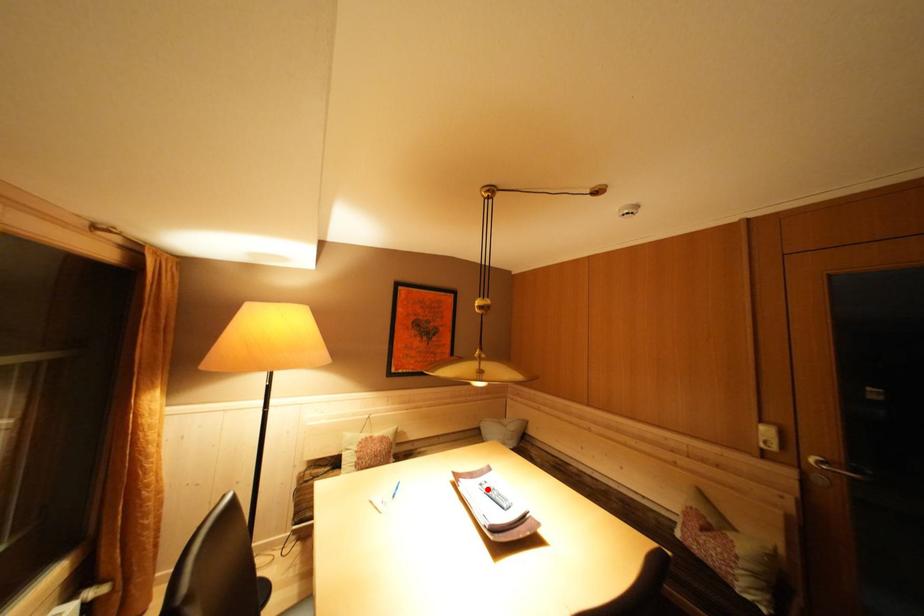
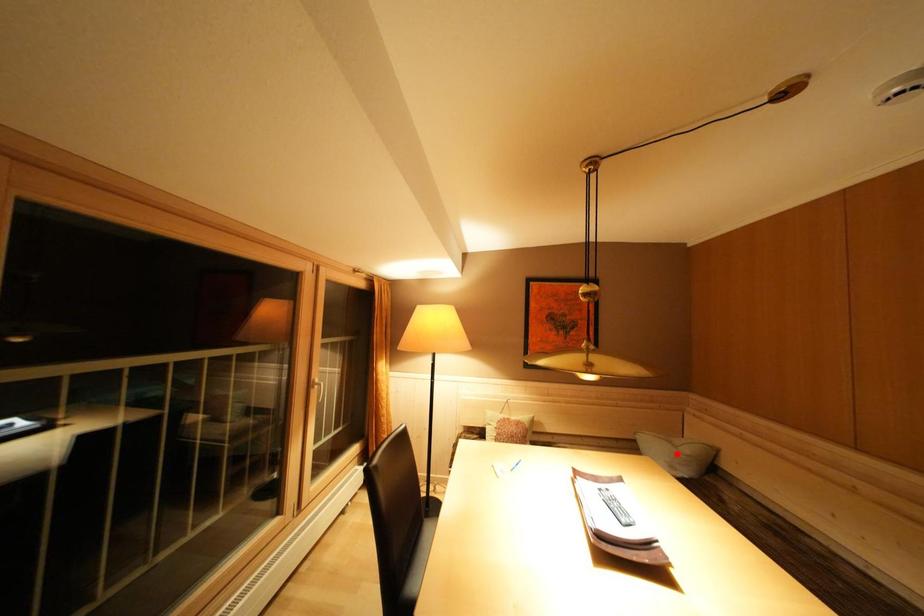
I am providing you with two images of the same scene from different viewpoints. A red point is marked on the first image and another point is marked on the second image. Do the highlighted points in image1 and image2 indicate the same real-world spot?

No